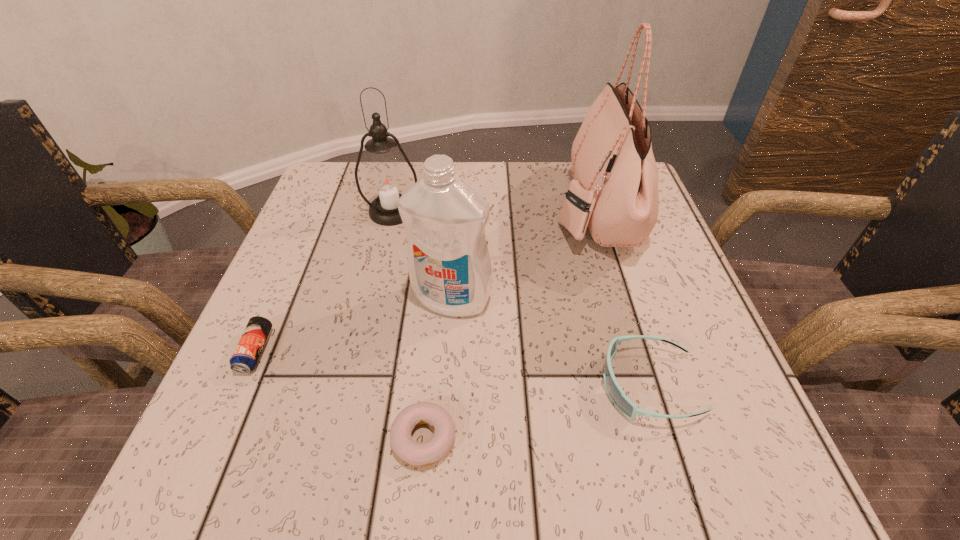
At what (x,y) coordinates should I click in order to perform the action: click on free region at the left edge of the desktop. Please return your answer as a coordinate pair (x, y). The width and height of the screenshot is (960, 540). Looking at the image, I should click on (348, 221).

I want to click on free region at the right edge, so click(x=671, y=310).

Image resolution: width=960 pixels, height=540 pixels. Identify the location of vacant space at the far left corner. (323, 174).

Where is `unoccupied area between the shortest object and the oil lamp`? Image resolution: width=960 pixels, height=540 pixels. unoccupied area between the shortest object and the oil lamp is located at coordinates (408, 325).

Identify the location of unoccupied area between the oil lamp and the doughnut. The image size is (960, 540). (408, 325).

Locate an element on the screen. This screenshot has height=540, width=960. vacant space in between the fifth tallest object and the oil lamp is located at coordinates (324, 281).

I want to click on blank region between the goggles and the tallest object, so (x=622, y=297).

Locate an element on the screen. The height and width of the screenshot is (540, 960). free space that is in between the doughnut and the tallest object is located at coordinates (509, 323).

You are a GUI agent. You are given a task and a screenshot of the screen. Output one action in this format:
    pyautogui.click(x=<x>, y=<y>)
    Task: Click on the vacant area that lies between the handbag and the detergent
    
    Given the screenshot: What is the action you would take?
    pyautogui.click(x=523, y=254)

The width and height of the screenshot is (960, 540). In order to click on vacant point located between the shortest object and the tallest object in this screenshot , I will do `click(509, 323)`.